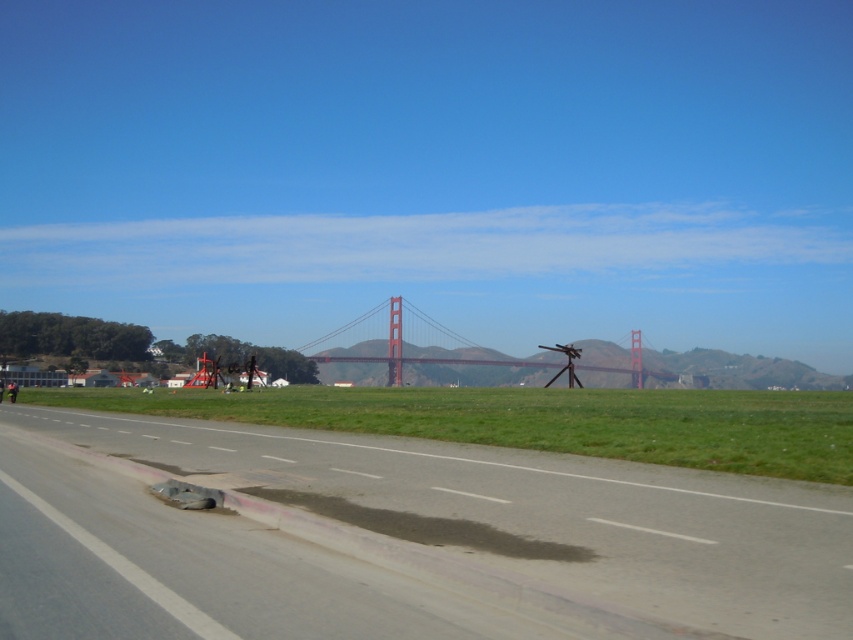
Is gray asphalt runway at center to the left of red metallic bridge at center from the viewer's perspective?

Indeed, gray asphalt runway at center is positioned on the left side of red metallic bridge at center.

Does gray asphalt runway at center have a greater height compared to red metallic bridge at center?

Incorrect, gray asphalt runway at center's height is not larger of red metallic bridge at center's.

I want to click on gray asphalt runway at center, so click(399, 540).